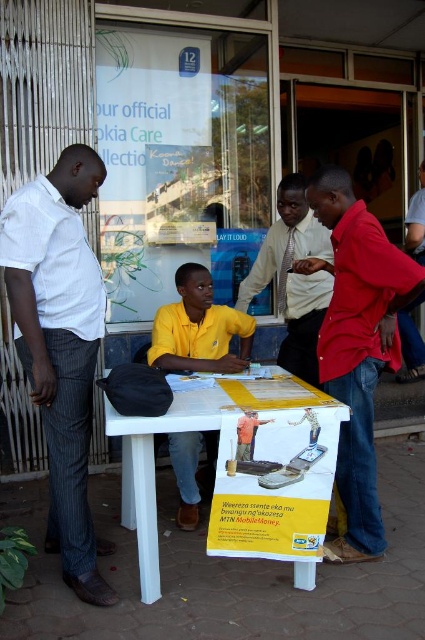
Between matte red shirt at center and white plastic table at center, which one is positioned lower?

white plastic table at center

This screenshot has height=640, width=425. In order to click on matte red shirt at center in this screenshot , I will do `click(357, 348)`.

The image size is (425, 640). Describe the element at coordinates (357, 348) in the screenshot. I see `matte red shirt at center` at that location.

Locate an element on the screen. This screenshot has height=640, width=425. matte red shirt at center is located at coordinates (357, 348).

Which is more to the left, white pinstripe pants at left or white plastic table at center?

Positioned to the left is white pinstripe pants at left.

Is point (68, 582) more distant than point (175, 417)?

Yes.

The image size is (425, 640). I want to click on white pinstripe pants at left, so click(61, 346).

Is point (152, 332) positioned after point (308, 579)?

Yes, it is behind point (308, 579).

Is yellow matte shirt at center to the left of white plastic table at center from the viewer's perspective?

Incorrect, yellow matte shirt at center is not on the left side of white plastic table at center.

Image resolution: width=425 pixels, height=640 pixels. What do you see at coordinates (198, 328) in the screenshot?
I see `yellow matte shirt at center` at bounding box center [198, 328].

Image resolution: width=425 pixels, height=640 pixels. I want to click on yellow matte shirt at center, so click(198, 328).